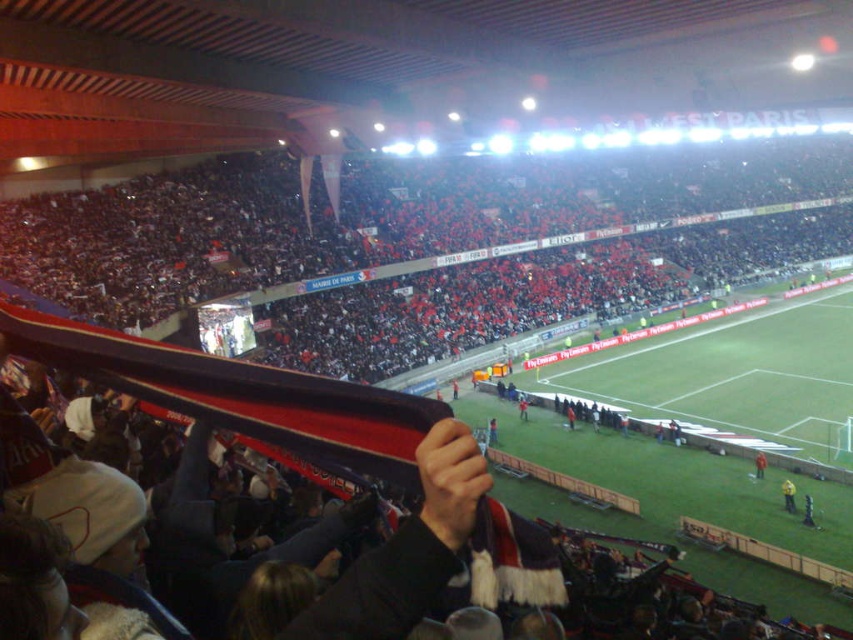
You are a photographer at the stadium and want to capture a photo that includes both the red fabric crowd at upper center and the yellow fabric at lower right. Based on their positions, which object should you focus on first to ensure both are in frame?

The red fabric crowd at upper center is located above the yellow fabric at lower right. To capture both in the frame, focus on the red fabric crowd at upper center first as it is higher up, then adjust the camera angle downward to include the yellow fabric at lower right.

You are standing at the point marked as point (663, 192) in the stadium. You want to take a photo of the entire field with your camera. The camera has a maximum zoom range that can capture objects up to 100 meters away. Will you be able to capture the entire field in your photo?

The distance between point (663, 192) and the camera is 90.64 meters, which is within the camera maximum zoom range of 100 meters. Therefore, you will be able to capture the entire field in your photo.

You are a photographer at the stadium and want to capture a photo that includes both the red and white striped scarf at center and the red fabric scarf at lower right. Which scarf should you position to the left side of your photo to ensure both are visible?

You should position the red and white striped scarf at center to the left side of your photo because it is already to the left of the red fabric scarf at lower right in the image.